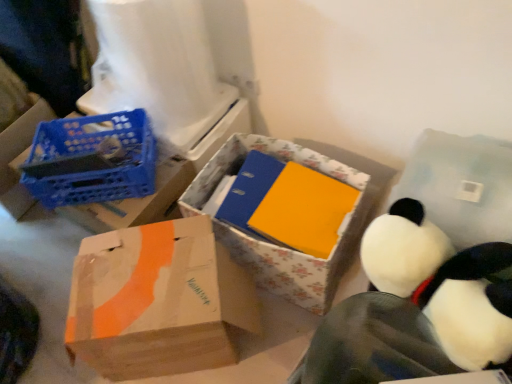
Question: Considering their positions, is blue plastic crate at left, the 1th box in the left-to-right sequence, located in front of or behind floral cardboard box at center, which is the third box from left to right?

Choices:
 (A) front
 (B) behind

Answer: (B)

Question: From the image's perspective, is blue plastic crate at left, the third box when ordered from right to left, positioned above or below floral cardboard box at center, which is the first box in right-to-left order?

Choices:
 (A) above
 (B) below

Answer: (A)

Question: Which object is the farthest from the blue plastic crate at left?

Choices:
 (A) white plush penguin at lower right
 (B) blue plastic crate at left, the third box when ordered from right to left
 (C) white plush toy at upper right
 (D) brown cardboard box at lower left, arranged as the second box when viewed from the right
 (E) white plastic toilet paper at upper left

Answer: (C)

Question: Which of these objects is positioned farthest from the blue plastic crate at left?

Choices:
 (A) white plastic toilet paper at upper left
 (B) floral cardboard box at center, which is the third box from left to right
 (C) white plush penguin at lower right
 (D) blue plastic crate at left, the third box when ordered from right to left
 (E) brown cardboard box at lower left, positioned as the second box in left-to-right order

Answer: (C)